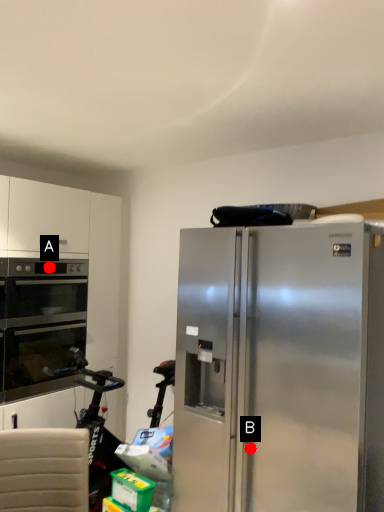
Question: Two points are circled on the image, labeled by A and B beside each circle. Which point is closer to the camera?

Choices:
 (A) A is closer
 (B) B is closer

Answer: (B)